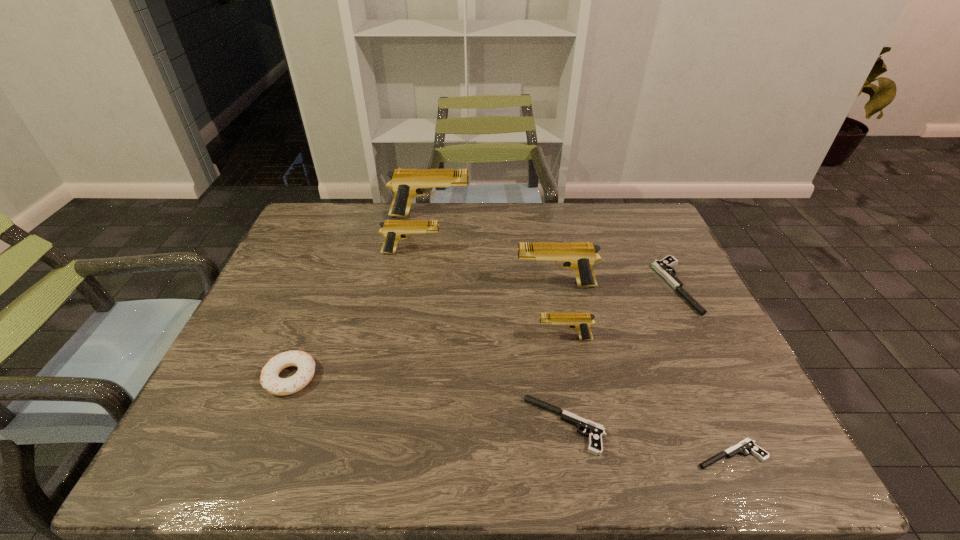
At what (x,y) coordinates should I click in order to perform the action: click on vacant position located 0.310m at the barrel of the second farthest pistol. Please return your answer as a coordinate pair (x, y). This screenshot has height=540, width=960. Looking at the image, I should click on (543, 253).

What are the coordinates of `vacant space situated 0.140m at the barrel of the nearest tan pistol` in the screenshot? It's located at (479, 339).

This screenshot has width=960, height=540. In order to click on vacant space positioned at the barrel of the nearest tan pistol in this screenshot , I will do `click(443, 339)`.

Where is `vacant space located 0.260m at the barrel of the nearest tan pistol`? The image size is (960, 540). vacant space located 0.260m at the barrel of the nearest tan pistol is located at coordinates (430, 339).

I want to click on free space located on the right of the white doughnut, so click(x=486, y=377).

Where is `vacant space located on the front-facing side of the biggest black pistol`? The width and height of the screenshot is (960, 540). vacant space located on the front-facing side of the biggest black pistol is located at coordinates (547, 286).

The image size is (960, 540). Identify the location of vacant region located on the front-facing side of the biggest black pistol. coord(540,286).

I want to click on free space located 0.320m on the front-facing side of the biggest black pistol, so click(543, 286).

Find the location of `vacant space located 0.350m on the front-facing side of the leftmost black pistol`. vacant space located 0.350m on the front-facing side of the leftmost black pistol is located at coordinates (354, 425).

Locate an element on the screen. Image resolution: width=960 pixels, height=540 pixels. vacant position located on the front-facing side of the leftmost black pistol is located at coordinates (496, 425).